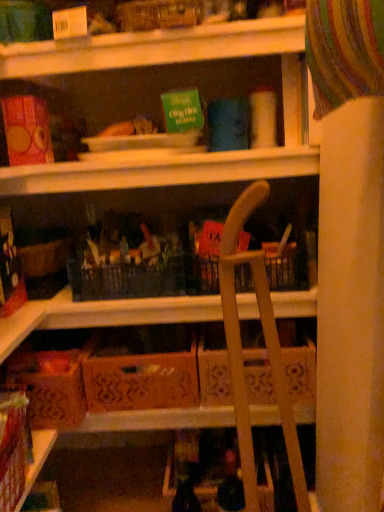
Question: Could brown cardboard box at lower left, the 2th cardboard box when ordered from right to left, be considered to be inside orange cardboard box at center, which is counted as the 2th cardboard box, starting from the left?

Choices:
 (A) no
 (B) yes

Answer: (A)

Question: Is orange cardboard box at center, marked as the 1th cardboard box in a right-to-left arrangement, not close to brown cardboard box at lower left, which is counted as the 1th cardboard box, starting from the left?

Choices:
 (A) no
 (B) yes

Answer: (A)

Question: Is orange cardboard box at center, which is counted as the 2th cardboard box, starting from the left, closer to camera compared to brown cardboard box at lower left, which is counted as the 1th cardboard box, starting from the left?

Choices:
 (A) yes
 (B) no

Answer: (B)

Question: From the image's perspective, would you say orange cardboard box at center, which is counted as the 2th cardboard box, starting from the left, is shown under brown cardboard box at lower left, the 2th cardboard box when ordered from right to left?

Choices:
 (A) yes
 (B) no

Answer: (B)

Question: From a real-world perspective, is orange cardboard box at center, which is counted as the 2th cardboard box, starting from the left, located beneath brown cardboard box at lower left, which is counted as the 1th cardboard box, starting from the left?

Choices:
 (A) yes
 (B) no

Answer: (A)

Question: Is orange cardboard box at center, marked as the 1th cardboard box in a right-to-left arrangement, in contact with brown cardboard box at lower left, the 2th cardboard box when ordered from right to left?

Choices:
 (A) no
 (B) yes

Answer: (A)

Question: Is orange cardboard box at center, marked as the 1th cardboard box in a right-to-left arrangement, outside wooden folding chair at center?

Choices:
 (A) yes
 (B) no

Answer: (A)

Question: Considering the relative positions of orange cardboard box at center, which is counted as the 2th cardboard box, starting from the left, and wooden folding chair at center in the image provided, is orange cardboard box at center, which is counted as the 2th cardboard box, starting from the left, to the left of wooden folding chair at center from the viewer's perspective?

Choices:
 (A) yes
 (B) no

Answer: (A)

Question: From a real-world perspective, is orange cardboard box at center, which is counted as the 2th cardboard box, starting from the left, on top of wooden folding chair at center?

Choices:
 (A) yes
 (B) no

Answer: (B)

Question: Does orange cardboard box at center, marked as the 1th cardboard box in a right-to-left arrangement, have a greater width compared to wooden folding chair at center?

Choices:
 (A) no
 (B) yes

Answer: (B)

Question: From a real-world perspective, is orange cardboard box at center, which is counted as the 2th cardboard box, starting from the left, below wooden folding chair at center?

Choices:
 (A) yes
 (B) no

Answer: (A)

Question: Is orange cardboard box at center, marked as the 1th cardboard box in a right-to-left arrangement, aimed at wooden folding chair at center?

Choices:
 (A) yes
 (B) no

Answer: (B)

Question: From a real-world perspective, is wooden folding chair at center below brown cardboard box at lower left, the 2th cardboard box when ordered from right to left?

Choices:
 (A) no
 (B) yes

Answer: (A)